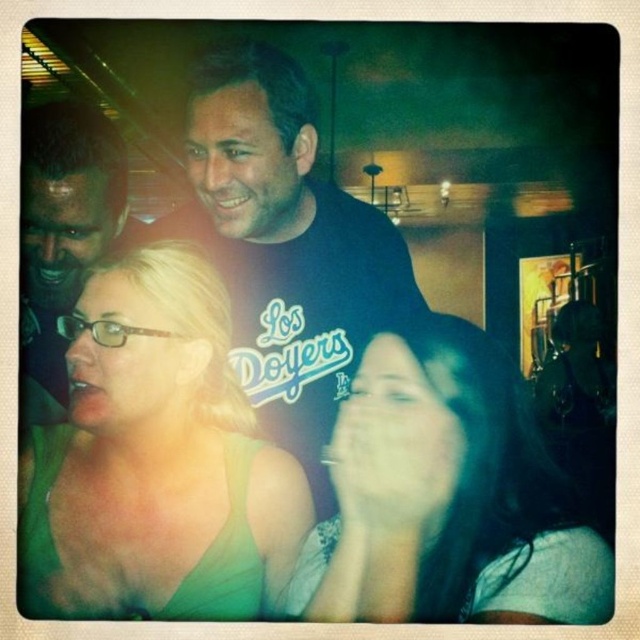
Which is in front, point (428, 404) or point (36, 349)?

Point (428, 404) is more forward.

Where is `smooth skin face at center`? This screenshot has height=640, width=640. smooth skin face at center is located at coordinates (445, 496).

Between point (480, 429) and point (35, 227), which one is positioned behind?

The point (35, 227) is more distant.

The image size is (640, 640). What are the coordinates of `smooth skin face at center` in the screenshot? It's located at (445, 496).

Measure the distance from green fabric top at center to matte black shirt at upper left.

green fabric top at center and matte black shirt at upper left are 10.39 inches apart from each other.

Between green fabric top at center and matte black shirt at upper left, which one appears on the left side from the viewer's perspective?

matte black shirt at upper left

The image size is (640, 640). I want to click on green fabric top at center, so click(157, 460).

Where is `green fabric top at center`? The width and height of the screenshot is (640, 640). green fabric top at center is located at coordinates (157, 460).

Does black cotton t-shirt at center have a greater width compared to matte black shirt at upper left?

Indeed, black cotton t-shirt at center has a greater width compared to matte black shirt at upper left.

Where is `black cotton t-shirt at center`? black cotton t-shirt at center is located at coordinates (285, 244).

You are a GUI agent. You are given a task and a screenshot of the screen. Output one action in this format:
    pyautogui.click(x=<x>, y=<y>)
    Task: Click on the black cotton t-shirt at center
    Image resolution: width=640 pixels, height=640 pixels.
    Given the screenshot: What is the action you would take?
    pyautogui.click(x=285, y=244)